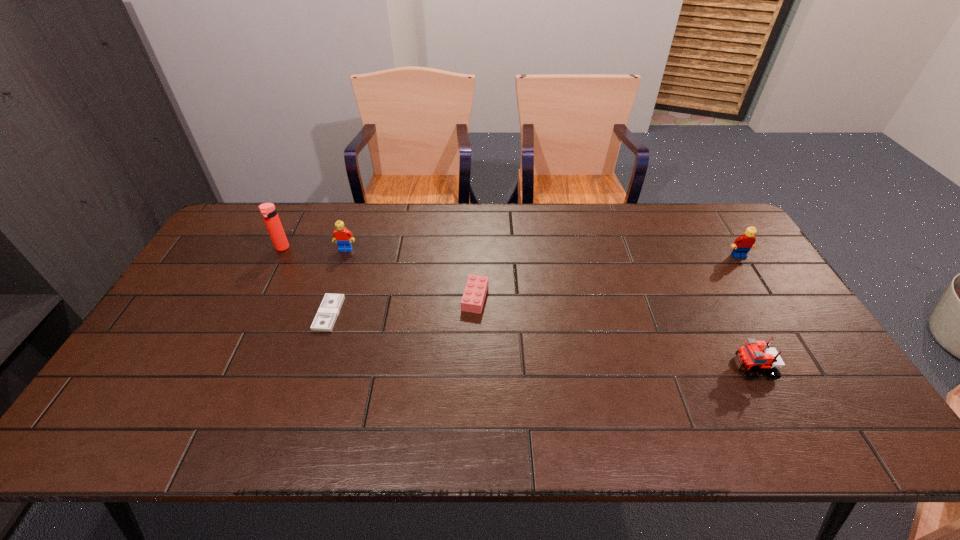
Locate an element on the screen. This screenshot has width=960, height=540. blank area in the image that satisfies the following two spatial constraints: 1. on the face of the leftmost Lego; 2. on the left side of the fifth tallest object is located at coordinates (329, 298).

Where is `vacant region that satisfies the following two spatial constraints: 1. on the face of the dollar; 2. on the left side of the farthest Lego`? The image size is (960, 540). vacant region that satisfies the following two spatial constraints: 1. on the face of the dollar; 2. on the left side of the farthest Lego is located at coordinates (324, 314).